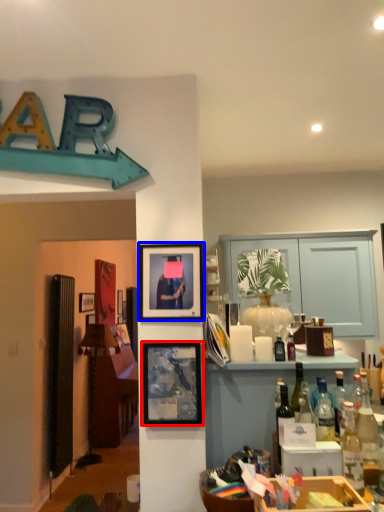
Question: Which object appears closest to the camera in this image, picture frame (highlighted by a red box) or picture frame (highlighted by a blue box)?

Choices:
 (A) picture frame
 (B) picture frame

Answer: (A)